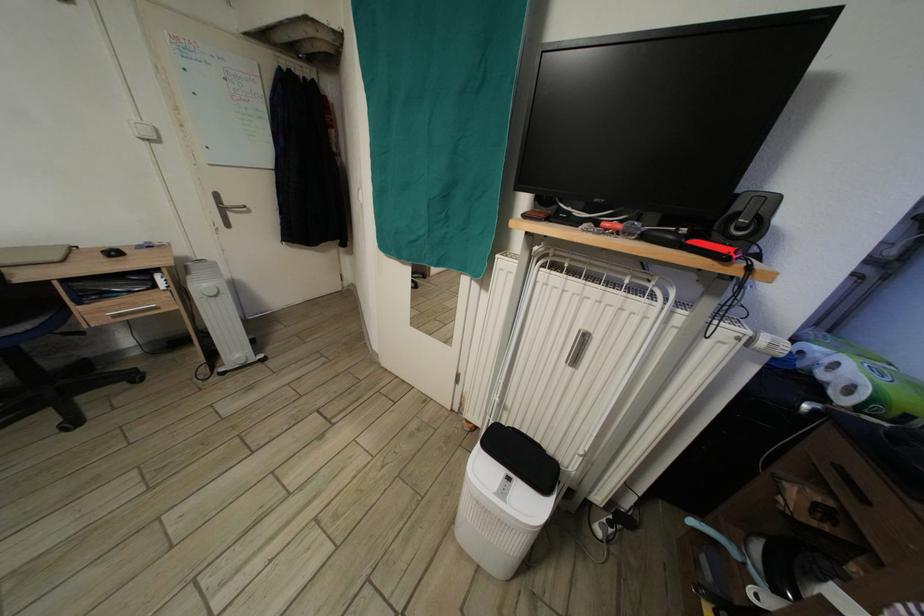
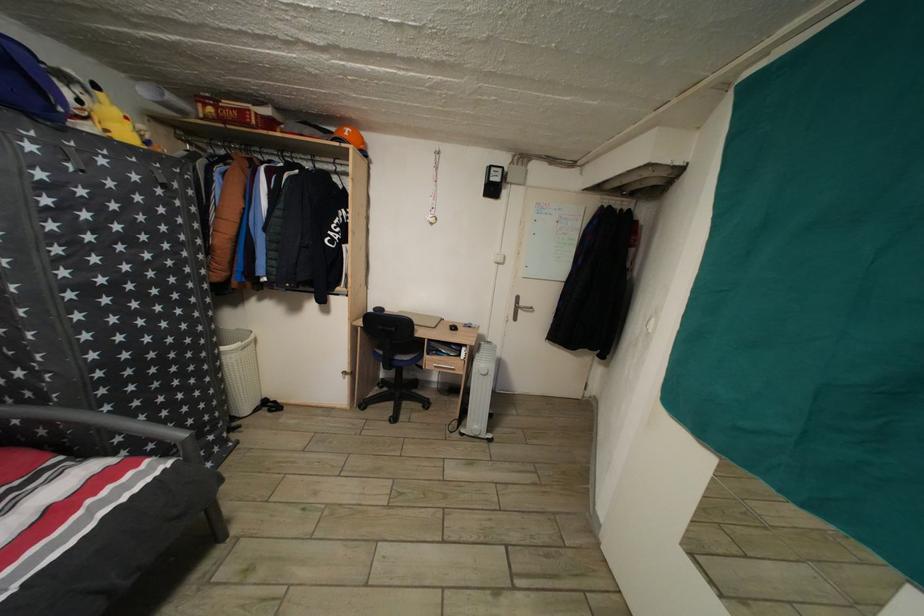
In the second image, find the point that corresponds to (x=107, y=305) in the first image.

(443, 361)